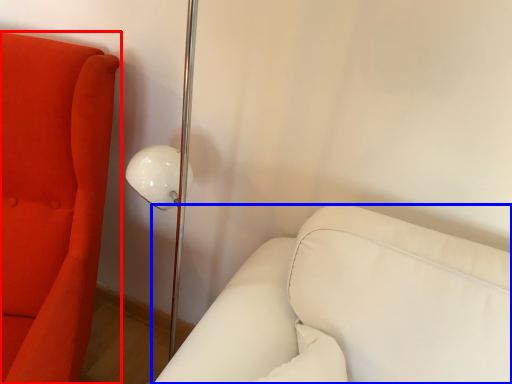
Question: Which point is closer to the camera, furniture (highlighted by a red box) or furniture (highlighted by a blue box)?

Choices:
 (A) furniture
 (B) furniture

Answer: (A)